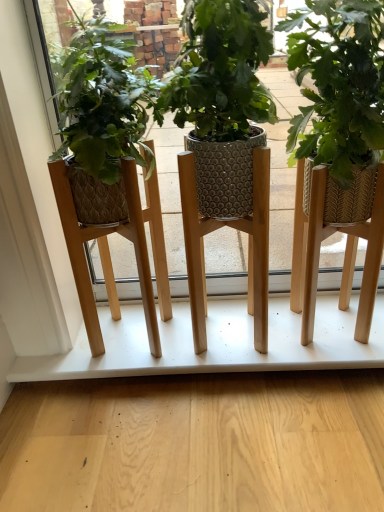
Where is `white matte shelf at center`? Image resolution: width=384 pixels, height=512 pixels. white matte shelf at center is located at coordinates (215, 342).

What do you see at coordinates (215, 342) in the screenshot? I see `white matte shelf at center` at bounding box center [215, 342].

In order to face green woven basket at center, should I rotate leftwards or rightwards?

To face it directly, rotate right by 19.499 degrees.

Describe the element at coordinates (339, 85) in the screenshot. The image size is (384, 512). I see `green woven basket at center` at that location.

You are a GUI agent. You are given a task and a screenshot of the screen. Output one action in this format:
    pyautogui.click(x=<x>, y=<y>)
    Task: Click on the green woven basket at center
    Image resolution: width=384 pixels, height=512 pixels.
    Given the screenshot: What is the action you would take?
    pyautogui.click(x=339, y=85)

You are a GUI agent. You are given a task and a screenshot of the screen. Output one action in this format:
    pyautogui.click(x=<x>, y=<y>)
    Task: Click on the white matte shelf at center
    
    Given the screenshot: What is the action you would take?
    pyautogui.click(x=215, y=342)

Does green woven basket at center appear on the right side of white matte shelf at center?

Indeed, green woven basket at center is positioned on the right side of white matte shelf at center.

Which is behind, green woven basket at center or white matte shelf at center?

white matte shelf at center is further from the camera.

Is point (347, 184) positioned after point (27, 361)?

That is False.

From the image's perspective, does green woven basket at center appear higher than white matte shelf at center?

Yes, from the image's perspective, green woven basket at center is over white matte shelf at center.

From a real-world perspective, is green woven basket at center above or below white matte shelf at center?

In terms of real-world spatial position, green woven basket at center is above white matte shelf at center.

Can you confirm if green woven basket at center is wider than white matte shelf at center?

Incorrect, the width of green woven basket at center does not surpass that of white matte shelf at center.

Between green woven basket at center and white matte shelf at center, which one has less height?

white matte shelf at center is shorter.

Can you confirm if green woven basket at center is smaller than white matte shelf at center?

Indeed, green woven basket at center has a smaller size compared to white matte shelf at center.

Is green woven basket at center spatially inside white matte shelf at center, or outside of it?

green woven basket at center lies outside white matte shelf at center.

Is green woven basket at center placed right next to white matte shelf at center?

There is a gap between green woven basket at center and white matte shelf at center.

From the picture: Does green woven basket at center turn towards white matte shelf at center?

No, green woven basket at center does not turn towards white matte shelf at center.

Can you tell me how much green woven basket at center and white matte shelf at center differ in facing direction?

green woven basket at center and white matte shelf at center are facing 1.84 degrees away from each other.

How distant is green woven basket at center from white matte shelf at center?

They are 44.59 centimeters apart.

Locate an element on the screen. Image resolution: width=384 pixels, height=512 pixels. houseplant positioned vertically above the white matte shelf at center (from a real-world perspective) is located at coordinates (339, 85).

Can you confirm if white matte shelf at center is positioned to the left of green woven basket at center?

Correct, you'll find white matte shelf at center to the left of green woven basket at center.

Does white matte shelf at center lie in front of green woven basket at center?

No, white matte shelf at center is behind green woven basket at center.

Is point (299, 362) closer or farther from the camera than point (311, 151)?

Clearly, point (299, 362) is more distant from the camera than point (311, 151).

From the image's perspective, would you say white matte shelf at center is shown under green woven basket at center?

Indeed, from the image's perspective, white matte shelf at center is shown beneath green woven basket at center.

From a real-world perspective, does white matte shelf at center sit lower than green woven basket at center?

Yes.

Is white matte shelf at center wider or thinner than green woven basket at center?

Considering their sizes, white matte shelf at center looks broader than green woven basket at center.

Between white matte shelf at center and green woven basket at center, which one has more height?

With more height is green woven basket at center.

Which of these two, white matte shelf at center or green woven basket at center, is smaller?

green woven basket at center.

Is white matte shelf at center located outside green woven basket at center?

Yes, white matte shelf at center is not within green woven basket at center.

Are white matte shelf at center and green woven basket at center beside each other?

white matte shelf at center is not next to green woven basket at center, and they're not touching.

Is white matte shelf at center facing away from green woven basket at center?

No, white matte shelf at center is not facing the opposite direction of green woven basket at center.

From the picture: What's the angular difference between white matte shelf at center and green woven basket at center's facing directions?

white matte shelf at center and green woven basket at center are facing 1.84 degrees away from each other.

Measure the distance between white matte shelf at center and green woven basket at center.

white matte shelf at center is 17.55 inches away from green woven basket at center.

Where is `houseplant in front of the white matte shelf at center`? Image resolution: width=384 pixels, height=512 pixels. houseplant in front of the white matte shelf at center is located at coordinates (339, 85).

You are a GUI agent. You are given a task and a screenshot of the screen. Output one action in this format:
    pyautogui.click(x=<x>, y=<y>)
    Task: Click on the houseplant above the white matte shelf at center (from a real-world perspective)
    
    Given the screenshot: What is the action you would take?
    pyautogui.click(x=339, y=85)

What are the coordinates of `houseplant above the white matte shelf at center (from the image's perspective)` in the screenshot? It's located at (339, 85).